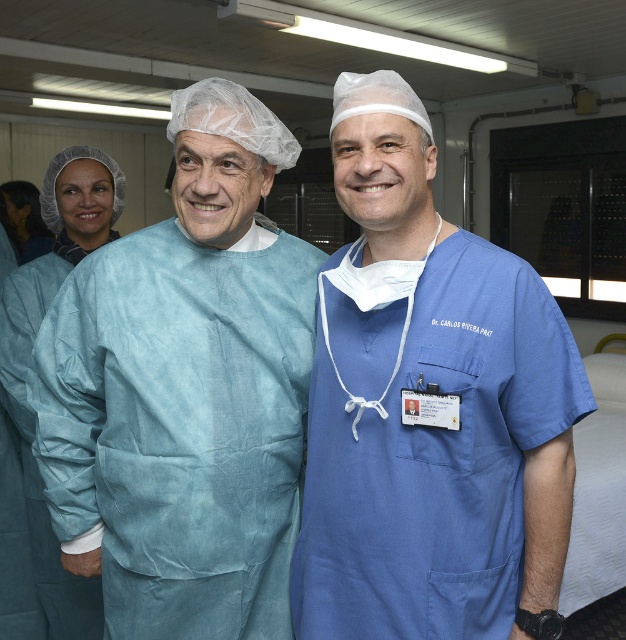
Does blue scrubs at center have a lesser height compared to blue scrubs at left?

Yes.

This screenshot has width=626, height=640. Describe the element at coordinates (429, 406) in the screenshot. I see `blue scrubs at center` at that location.

At what (x,y) coordinates should I click in order to perform the action: click on blue scrubs at center. Please return your answer as a coordinate pair (x, y). Looking at the image, I should click on (429, 406).

I want to click on blue scrubs at center, so click(x=429, y=406).

Is blue scrubs at center shorter than blue smooth scrubs at center?

Yes.

You are a GUI agent. You are given a task and a screenshot of the screen. Output one action in this format:
    pyautogui.click(x=<x>, y=<y>)
    Task: Click on the blue scrubs at center
    The width and height of the screenshot is (626, 640).
    Given the screenshot: What is the action you would take?
    pyautogui.click(x=429, y=406)

Can you confirm if blue smooth scrubs at center is taller than blue scrubs at left?

Incorrect, blue smooth scrubs at center's height is not larger of blue scrubs at left's.

Which is more to the right, blue smooth scrubs at center or blue scrubs at left?

blue smooth scrubs at center is more to the right.

Between point (260, 518) and point (100, 221), which one is positioned behind?

The point (100, 221) is more distant.

I want to click on blue smooth scrubs at center, so click(x=185, y=390).